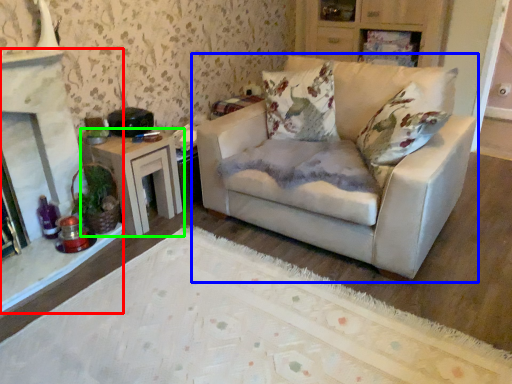
Question: Estimate the real-world distances between objects in this image. Which object is farther from fireplace (highlighted by a red box), studio couch (highlighted by a blue box) or table (highlighted by a green box)?

Choices:
 (A) studio couch
 (B) table

Answer: (A)